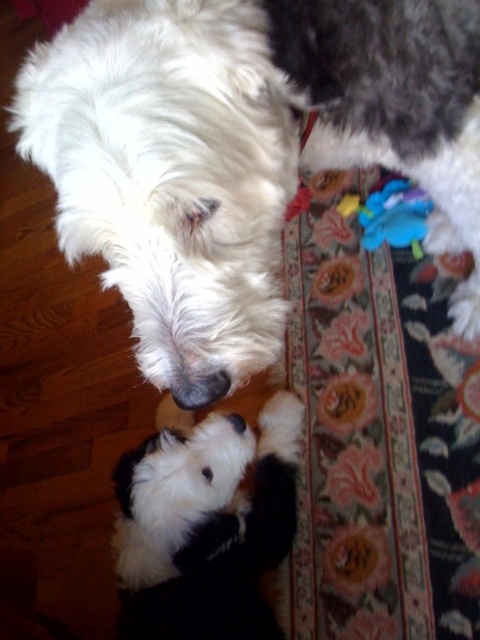
Question: Does blue fabric toy at center appear on the left side of black fur nose at center?

Choices:
 (A) yes
 (B) no

Answer: (B)

Question: Is blue fabric toy at center positioned before black fur nose at center?

Choices:
 (A) yes
 (B) no

Answer: (B)

Question: Which object appears closest to the camera in this image?

Choices:
 (A) blue fabric toy at center
 (B) black fur nose at center
 (C) fluffy white dog at upper right

Answer: (C)

Question: From the image, what is the correct spatial relationship of white fluffy dog at upper left in relation to black fur nose at center?

Choices:
 (A) left
 (B) right

Answer: (A)

Question: Among these objects, which one is nearest to the camera?

Choices:
 (A) white fluffy dog at upper left
 (B) blue fabric toy at center
 (C) fluffy white dog at upper right

Answer: (A)

Question: Among these points, which one is farthest from the camera?

Choices:
 (A) click(153, 326)
 (B) click(462, 284)

Answer: (B)